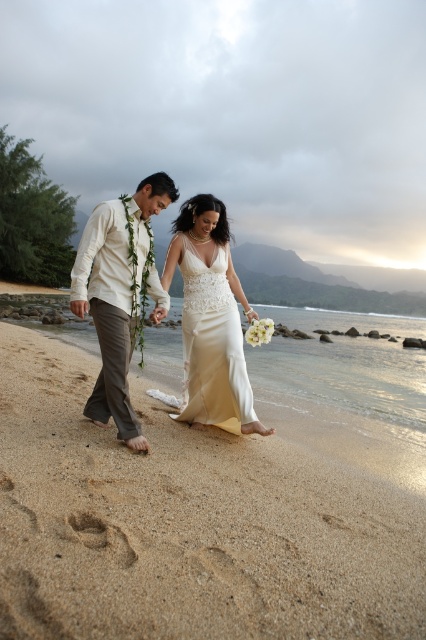
You are a photographer planning to capture the couple in their wedding attire. You notice the white cotton shirt at center and the brown sandy footprint at lower center. Which object is covering the other one in the image?

The white cotton shirt at center is positioned over brown sandy footprint at lower center, so it is covering the footprint.

You are a photographer planning to take a photo of the ivory satin dress at center and the light beige sand at lower center. The minimum distance your camera can focus clearly on both subjects is 30 inches. Will both subjects be in focus at the same time?

The light beige sand at lower center is 35.39 inches from the ivory satin dress at center. Since the distance between them is greater than the camera sensor depth of field minimum focus distance of 30 inches, both subjects will not be in focus simultaneously.

You are a photographer standing at the edge of the beach. You see the white cotton shirt at center and the brown sandy footprint at lower center in your viewfinder. Which object appears larger in your camera frame?

The white cotton shirt at center appears larger in the camera frame because it is taller than the brown sandy footprint at lower center.